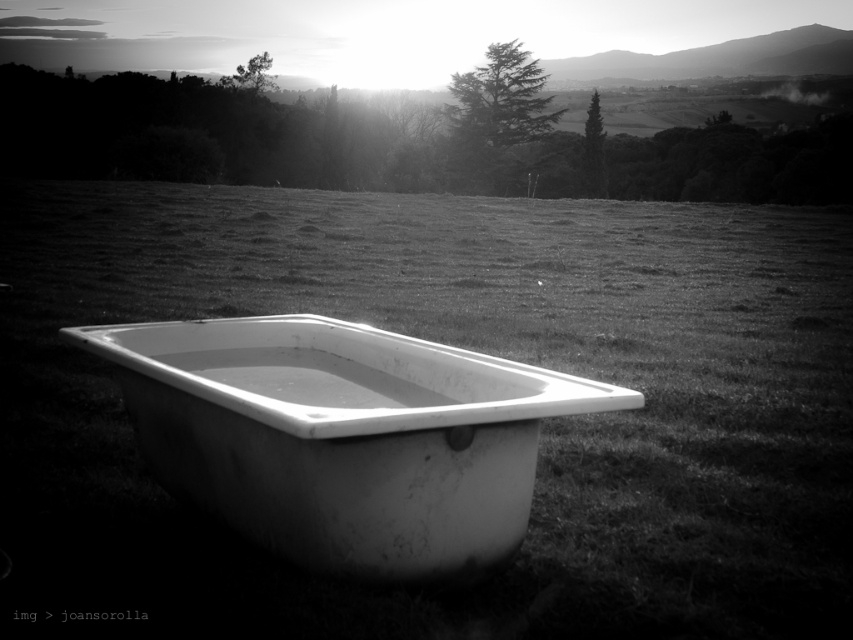
You are standing in the middle of the grassy field and see the white matte bathtub at center. Which direction should you walk to reach the smooth grass at center from your current position?

You should walk to the left to reach the smooth grass at center, as it is located to the left of the white matte bathtub at center.

You are standing at the edge of the grassy field where the vintage bathtub is placed. You want to place a small decorative rock exactly at the center of the smooth grass at center. According to the image, what are the coordinates where you should place the rock?

The coordinates for the smooth grass at center are at point (469, 348), so you should place the rock at those coordinates.

You are standing at the edge of the grassy field and want to place a 10 feet long wooden bench between the smooth grass at center and the white matte bathtub at center. Is there enough space to fit the bench without overlapping either object?

The distance between the smooth grass at center and the white matte bathtub at center is 11.04 feet. Since the bench is 10 feet long, there is enough space to place it between them without overlapping either object.